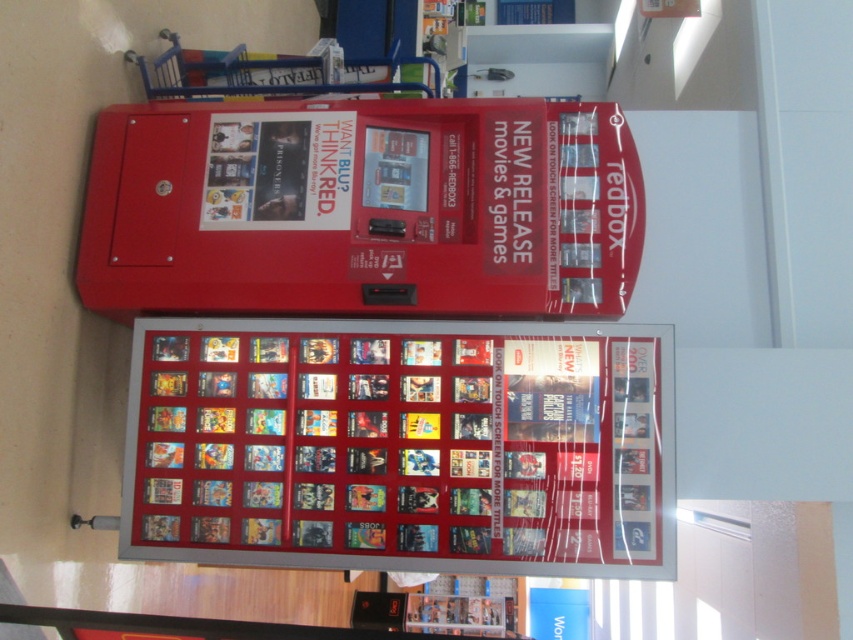
You are standing in front of the Redbox movie rental kiosk. You need to place a new poster that is 1 meter wide between the metallic silver frame at center and the metallic red vending machine at center. Is there enough space between them to fit the poster?

The metallic silver frame at center is narrower than the metallic red vending machine at center. However, the exact distance between them isn

You are standing in front of the Redbox kiosk and want to touch both the metallic silver frame at center and the metallic red vending machine at center. Which one will you touch first?

You will touch the metallic silver frame at center first because it is closer to you than the metallic red vending machine at center.

You are a person standing in front of the Redbox movie rental kiosk. You want to take a photo of the metallic silver frame at center without getting too close. If your camera has a maximum focus range of 2.5 meters, will you be able to take a clear photo from your current position?

The metallic silver frame at center and camera are 2.65 meters apart from each other, which exceeds the camera maximum focus range of 2.5 meters. Therefore, you will not be able to take a clear photo from your current position.